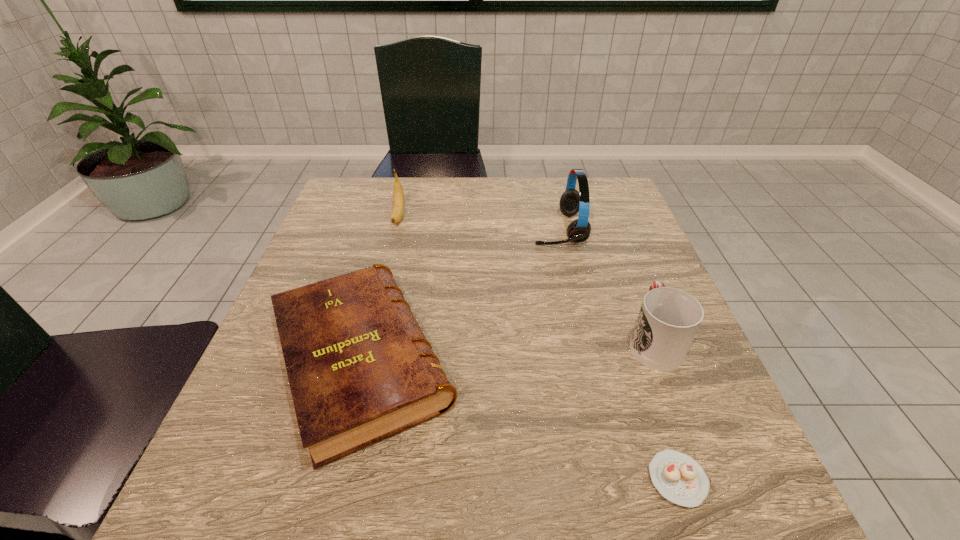
You are a GUI agent. You are given a task and a screenshot of the screen. Output one action in this format:
    pyautogui.click(x=<x>, y=<y>)
    Task: Click on the object that is the second closest to the cup
    The width and height of the screenshot is (960, 540).
    Given the screenshot: What is the action you would take?
    pyautogui.click(x=571, y=202)

Image resolution: width=960 pixels, height=540 pixels. Find the location of `object that is the fourth closest to the banana`. object that is the fourth closest to the banana is located at coordinates (678, 477).

The height and width of the screenshot is (540, 960). What are the coordinates of `vacant area in the image that satisfies the following two spatial constraints: 1. with the microphone attached to the side of the shortest object; 2. on the left side of the headset` in the screenshot? It's located at (616, 480).

At what (x,y) coordinates should I click in order to perform the action: click on vacant area that satisfies the following two spatial constraints: 1. at the start of the peel on the banana; 2. on the right side of the cupcake. Please return your answer as a coordinate pair (x, y). Image resolution: width=960 pixels, height=540 pixels. Looking at the image, I should click on (333, 480).

Find the location of `vacant area in the image that satisfies the following two spatial constraints: 1. with the microphone attached to the side of the tallest object; 2. on the front side of the hardback book`. vacant area in the image that satisfies the following two spatial constraints: 1. with the microphone attached to the side of the tallest object; 2. on the front side of the hardback book is located at coordinates (588, 361).

I want to click on free space that satisfies the following two spatial constraints: 1. with the microphone attached to the side of the tallest object; 2. on the handle side of the cup, so (584, 341).

Identify the location of free spot that satisfies the following two spatial constraints: 1. with the microphone attached to the side of the tallest object; 2. on the handle side of the cup. The width and height of the screenshot is (960, 540). 584,341.